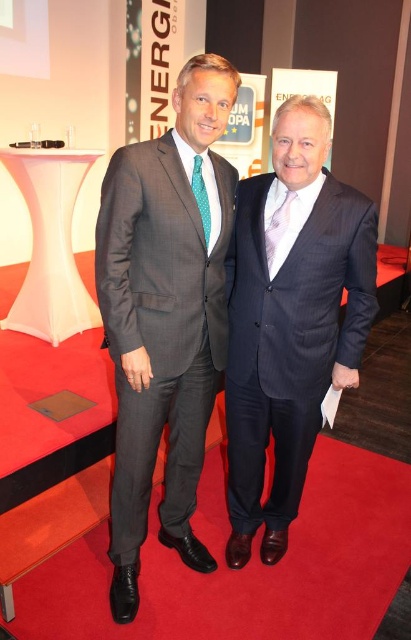
Question: Among these points, which one is nearest to the camera?

Choices:
 (A) (367, 234)
 (B) (136, 234)

Answer: (B)

Question: Does matte gray suit at center have a greater width compared to matte blue suit at center?

Choices:
 (A) yes
 (B) no

Answer: (B)

Question: Is the position of matte gray suit at center less distant than that of matte blue suit at center?

Choices:
 (A) no
 (B) yes

Answer: (B)

Question: Is matte gray suit at center smaller than matte blue suit at center?

Choices:
 (A) yes
 (B) no

Answer: (B)